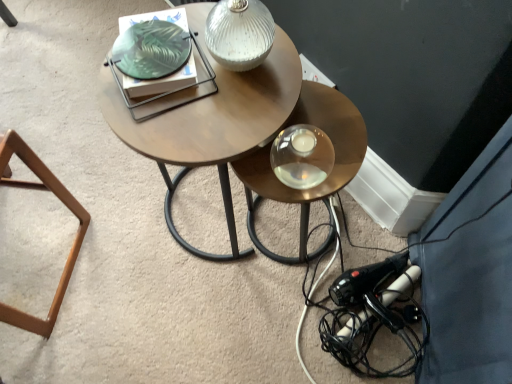
The width and height of the screenshot is (512, 384). Describe the element at coordinates (212, 120) in the screenshot. I see `woodenmaterial/texturecoffee table at center` at that location.

Locate an element on the screen. woodenmaterial/texturecoffee table at center is located at coordinates (212, 120).

The width and height of the screenshot is (512, 384). Describe the element at coordinates (239, 34) in the screenshot. I see `white textured glass table lamp at upper center` at that location.

Identify the location of woodenmaterial/texturecoffee table at center. 212,120.

Which of these two, white textured glass table lamp at upper center or brown wooden stool at lower left, is bigger?

With larger size is brown wooden stool at lower left.

Is white textured glass table lamp at upper center oriented towards brown wooden stool at lower left?

No, white textured glass table lamp at upper center is not aimed at brown wooden stool at lower left.

In terms of width, does white textured glass table lamp at upper center look wider or thinner when compared to brown wooden stool at lower left?

In the image, white textured glass table lamp at upper center appears to be more narrow than brown wooden stool at lower left.

Considering the sizes of woodenmaterial/texturecoffee table at center and white textured glass table lamp at upper center in the image, is woodenmaterial/texturecoffee table at center taller or shorter than white textured glass table lamp at upper center?

woodenmaterial/texturecoffee table at center is taller than white textured glass table lamp at upper center.

Is woodenmaterial/texturecoffee table at center looking in the opposite direction of white textured glass table lamp at upper center?

No, woodenmaterial/texturecoffee table at center is not facing the opposite direction of white textured glass table lamp at upper center.

How many degrees apart are the facing directions of woodenmaterial/texturecoffee table at center and white textured glass table lamp at upper center?

The angle between the facing direction of woodenmaterial/texturecoffee table at center and the facing direction of white textured glass table lamp at upper center is 18.4 degrees.

Looking at this image, from the image's perspective, is woodenmaterial/texturecoffee table at center over white textured glass table lamp at upper center?

No, from the image's perspective, woodenmaterial/texturecoffee table at center is not over white textured glass table lamp at upper center.

From the image's perspective, which one is positioned higher, brown wooden stool at lower left or white textured glass table lamp at upper center?

white textured glass table lamp at upper center.

Is point (41, 325) closer or farther from the camera than point (220, 28)?

Clearly, point (41, 325) is more distant from the camera than point (220, 28).

From a real-world perspective, is brown wooden stool at lower left positioned above or below white textured glass table lamp at upper center?

From a real-world perspective, brown wooden stool at lower left is physically below white textured glass table lamp at upper center.

What's the angular difference between brown wooden stool at lower left and white textured glass table lamp at upper center's facing directions?

The angular difference between brown wooden stool at lower left and white textured glass table lamp at upper center is 161 degrees.

Is woodenmaterial/texturecoffee table at center shorter than black plastic hairdryer at lower right?

No.

From the image's perspective, relative to black plastic hairdryer at lower right, is woodenmaterial/texturecoffee table at center above or below?

Based on their image positions, woodenmaterial/texturecoffee table at center is located above black plastic hairdryer at lower right.

What's the angular difference between woodenmaterial/texturecoffee table at center and black plastic hairdryer at lower right's facing directions?

53.4 degrees separate the facing orientations of woodenmaterial/texturecoffee table at center and black plastic hairdryer at lower right.

Consider the image. Between woodenmaterial/texturecoffee table at center and black plastic hairdryer at lower right, which one appears on the right side from the viewer's perspective?

black plastic hairdryer at lower right.

Find the location of a particular element. The image size is (512, 384). table behind the white textured glass table lamp at upper center is located at coordinates (327, 177).

From a real-world perspective, is metallic gold table at center located higher than white textured glass table lamp at upper center?

No.

Is metallic gold table at center shorter than white textured glass table lamp at upper center?

No.

Is metallic gold table at center facing away from white textured glass table lamp at upper center?

No.

Is white textured glass table lamp at upper center to the left of black plastic hairdryer at lower right from the viewer's perspective?

Yes, white textured glass table lamp at upper center is to the left of black plastic hairdryer at lower right.

Which is nearer, (249, 4) or (298, 337)?

The point (249, 4) is in front.

Is black plastic hairdryer at lower right inside white textured glass table lamp at upper center?

No.

From the image's perspective, would you say white textured glass table lamp at upper center is shown under black plastic hairdryer at lower right?

No.

Is the surface of white textured glass table lamp at upper center in direct contact with woodenmaterial/texturecoffee table at center?

Yes, white textured glass table lamp at upper center is in contact with woodenmaterial/texturecoffee table at center.

Is white textured glass table lamp at upper center spatially inside woodenmaterial/texturecoffee table at center, or outside of it?

white textured glass table lamp at upper center is spatially situated outside woodenmaterial/texturecoffee table at center.

Looking at this image, from a real-world perspective, which is physically below, white textured glass table lamp at upper center or woodenmaterial/texturecoffee table at center?

From a 3D spatial view, woodenmaterial/texturecoffee table at center is below.

Is white textured glass table lamp at upper center turned away from woodenmaterial/texturecoffee table at center?

No, white textured glass table lamp at upper center is not facing away from woodenmaterial/texturecoffee table at center.

Find the location of a particular element. Image resolution: width=512 pixels, height=384 pixels. table lamp above the brown wooden stool at lower left (from a real-world perspective) is located at coordinates (239, 34).

Locate an element on the screen. The height and width of the screenshot is (384, 512). table lamp in front of the woodenmaterial/texturecoffee table at center is located at coordinates (239, 34).

Based on their spatial positions, is woodenmaterial/texturecoffee table at center or white textured glass table lamp at upper center closer to metallic gold table at center?

woodenmaterial/texturecoffee table at center lies closer to metallic gold table at center than the other object.

Based on their spatial positions, is white textured glass table lamp at upper center or black plastic hairdryer at lower right closer to metallic gold table at center?

Based on the image, white textured glass table lamp at upper center appears to be nearer to metallic gold table at center.

Considering their positions, is brown wooden stool at lower left positioned further to woodenmaterial/texturecoffee table at center than metallic gold table at center?

brown wooden stool at lower left.

From the image, which object appears to be farther from white textured glass table lamp at upper center, metallic gold table at center or woodenmaterial/texturecoffee table at center?

metallic gold table at center is further to white textured glass table lamp at upper center.

Estimate the real-world distances between objects in this image. Which object is closer to black plastic hairdryer at lower right, brown wooden stool at lower left or white textured glass table lamp at upper center?

white textured glass table lamp at upper center.

Consider the image. When comparing their distances from brown wooden stool at lower left, does black plastic hairdryer at lower right or woodenmaterial/texturecoffee table at center seem closer?

woodenmaterial/texturecoffee table at center.

When comparing their distances from white textured glass table lamp at upper center, does woodenmaterial/texturecoffee table at center or brown wooden stool at lower left seem closer?

Based on the image, woodenmaterial/texturecoffee table at center appears to be nearer to white textured glass table lamp at upper center.

From the image, which object appears to be farther from black plastic hairdryer at lower right, woodenmaterial/texturecoffee table at center or brown wooden stool at lower left?

Among the two, brown wooden stool at lower left is located further to black plastic hairdryer at lower right.

I want to click on coffee table between brown wooden stool at lower left and black plastic hairdryer at lower right in the horizontal direction, so click(x=212, y=120).

At what (x,y) coordinates should I click in order to perform the action: click on coffee table between brown wooden stool at lower left and metallic gold table at center from left to right. Please return your answer as a coordinate pair (x, y). Looking at the image, I should click on (212, 120).

Where is `table lamp between brown wooden stool at lower left and metallic gold table at center from left to right`? table lamp between brown wooden stool at lower left and metallic gold table at center from left to right is located at coordinates (239, 34).

Where is `table between woodenmaterial/texturecoffee table at center and black plastic hairdryer at lower right vertically`? table between woodenmaterial/texturecoffee table at center and black plastic hairdryer at lower right vertically is located at coordinates (327, 177).